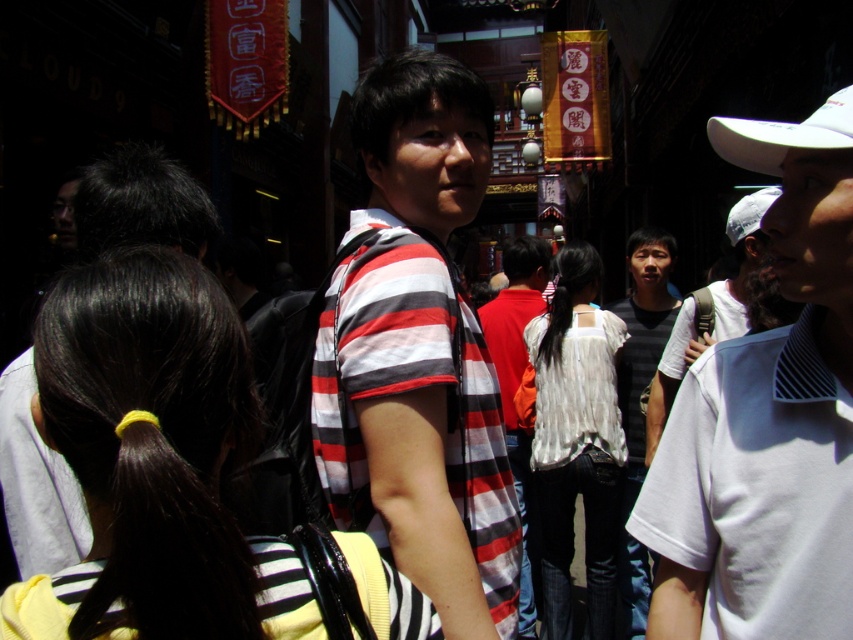
Question: Among these objects, which one is nearest to the camera?

Choices:
 (A) dark gray t-shirt at right
 (B) dark gray striped shirt at center
 (C) white fabric baseball cap at upper right

Answer: (C)

Question: Which of the following is the farthest from the observer?

Choices:
 (A) (741, 304)
 (B) (756, 129)
 (C) (758, 220)
 (D) (463, 461)

Answer: (A)

Question: Which is nearer to the striped cotton shirt at center?

Choices:
 (A) dark gray t-shirt at right
 (B) white cotton shirt at center

Answer: (B)

Question: Is dark gray striped shirt at center smaller than white fabric baseball cap at upper right?

Choices:
 (A) yes
 (B) no

Answer: (B)

Question: Can you confirm if dark gray striped shirt at center is thinner than white matte baseball cap at upper right?

Choices:
 (A) yes
 (B) no

Answer: (B)

Question: Does white cotton shirt at center come behind white matte baseball cap at upper right?

Choices:
 (A) no
 (B) yes

Answer: (A)